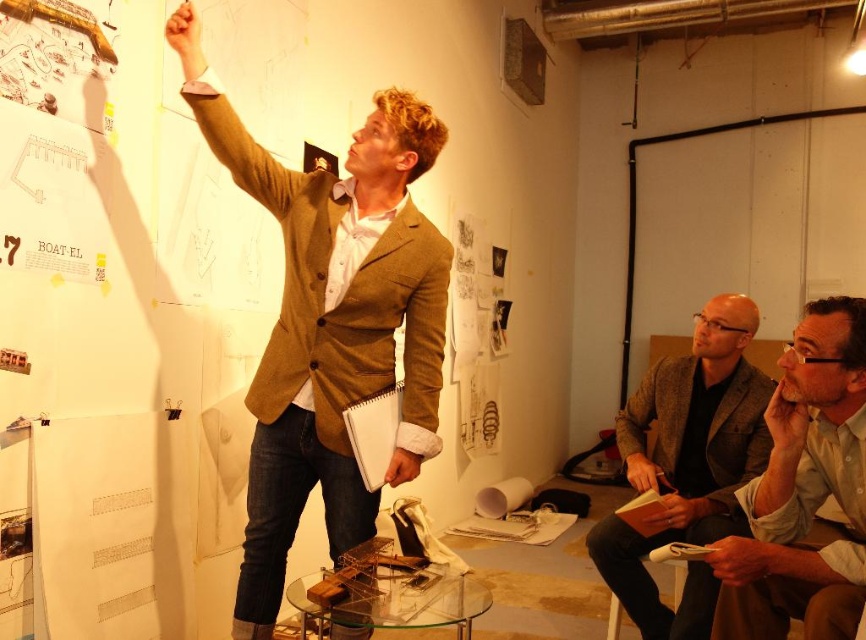
Question: Which object appears farthest from the camera in this image?

Choices:
 (A) white plastic stool at lower right
 (B) brown woolen blazer at lower right
 (C) brown textured blazer at upper center

Answer: (A)

Question: Can you confirm if light brown leather jacket at lower right is thinner than white plastic stool at lower right?

Choices:
 (A) no
 (B) yes

Answer: (A)

Question: Which of these objects is positioned closest to the light brown leather jacket at lower right?

Choices:
 (A) brown woolen blazer at lower right
 (B) white plastic stool at lower right
 (C) brown textured blazer at upper center

Answer: (A)

Question: Considering the relative positions of brown textured blazer at upper center and white plastic stool at lower right in the image provided, where is brown textured blazer at upper center located with respect to white plastic stool at lower right?

Choices:
 (A) left
 (B) right

Answer: (A)

Question: Does light brown leather jacket at lower right appear under white plastic stool at lower right?

Choices:
 (A) no
 (B) yes

Answer: (A)

Question: Which of these objects is positioned farthest from the light brown leather jacket at lower right?

Choices:
 (A) brown textured blazer at upper center
 (B) brown woolen blazer at lower right

Answer: (A)